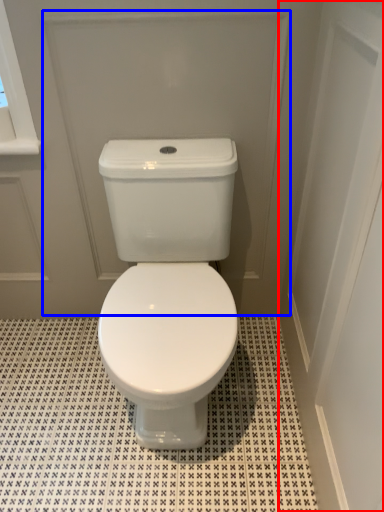
Question: Which object is closer to the camera taking this photo, screen door (highlighted by a red box) or screen door (highlighted by a blue box)?

Choices:
 (A) screen door
 (B) screen door

Answer: (A)